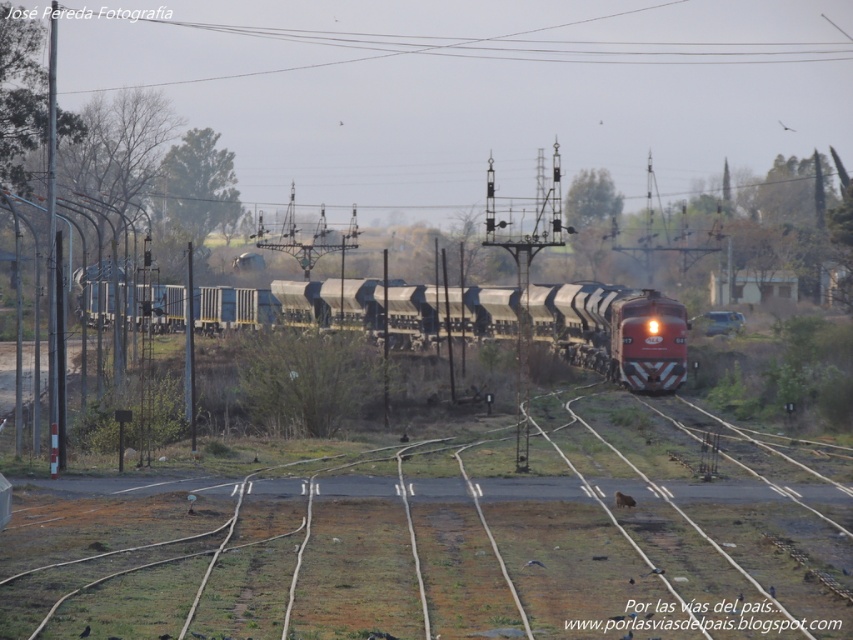
Question: Which point appears closest to the camera in this image?

Choices:
 (A) (601, 308)
 (B) (727, 596)

Answer: (B)

Question: Does brown dirt track at center have a larger size compared to metallic freight train at center?

Choices:
 (A) yes
 (B) no

Answer: (B)

Question: Can you confirm if brown dirt track at center is thinner than metallic freight train at center?

Choices:
 (A) no
 (B) yes

Answer: (B)

Question: Where is brown dirt track at center located in relation to metallic freight train at center in the image?

Choices:
 (A) left
 (B) right

Answer: (B)

Question: Among these points, which one is nearest to the camera?

Choices:
 (A) (270, 634)
 (B) (355, 323)

Answer: (A)

Question: Which point appears farthest from the camera in this image?

Choices:
 (A) (757, 468)
 (B) (612, 353)

Answer: (B)